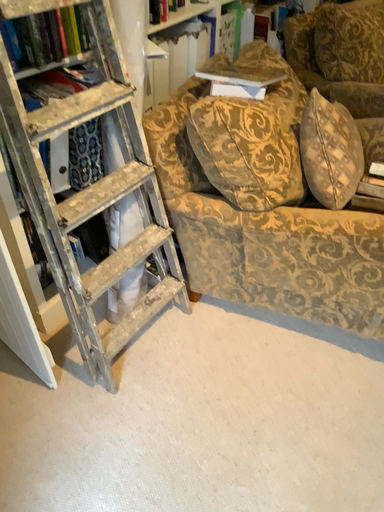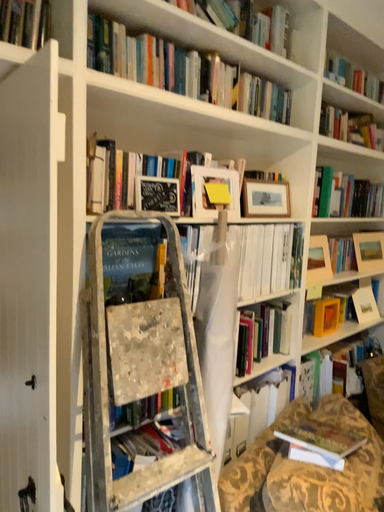
Question: How did the camera likely rotate when shooting the video?

Choices:
 (A) rotated upward
 (B) rotated downward

Answer: (A)